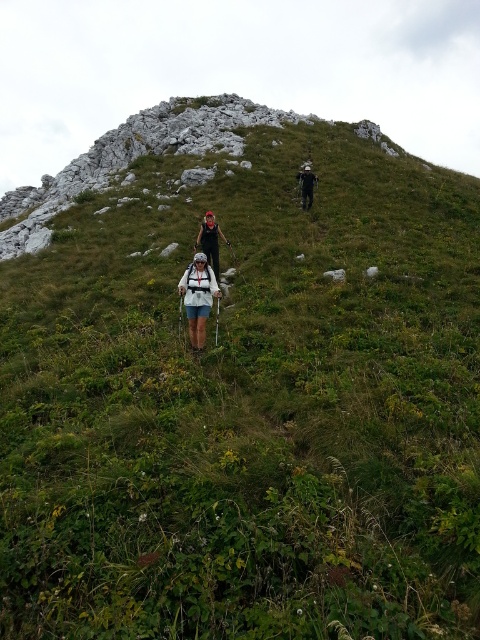
You are a hiker carrying a 2.5 meter long tent pole. You want to place it between the white matte backpack at center and the black fabric backpack at center. Is there enough space to fit the tent pole horizontally between them?

The distance between the white matte backpack at center and the black fabric backpack at center is 3.85 meters. Since the tent pole is 2.5 meters long, there is sufficient space to place it horizontally between them.

You are a hiker looking to follow the group up the hill. You notice the black fabric backpack at center and the dark gray fabric backpack at upper center. Which backpack is positioned higher on the slope?

The dark gray fabric backpack at upper center is positioned higher on the slope than the black fabric backpack at center.

Consider the image. You are a hiker trying to locate your backpack in the image. The backpack is at point (210,241). Which hiker is carrying the black fabric backpack at center?

The black fabric backpack at center is represented by point (210,241), so the hiker in the center wearing a white jacket, blue shorts, and a white cap is carrying the black fabric backpack at center.